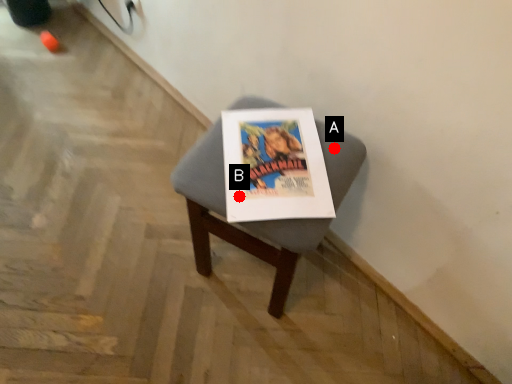
Question: Two points are circled on the image, labeled by A and B beside each circle. Which of the following is the closest to the observer?

Choices:
 (A) A is closer
 (B) B is closer

Answer: (B)